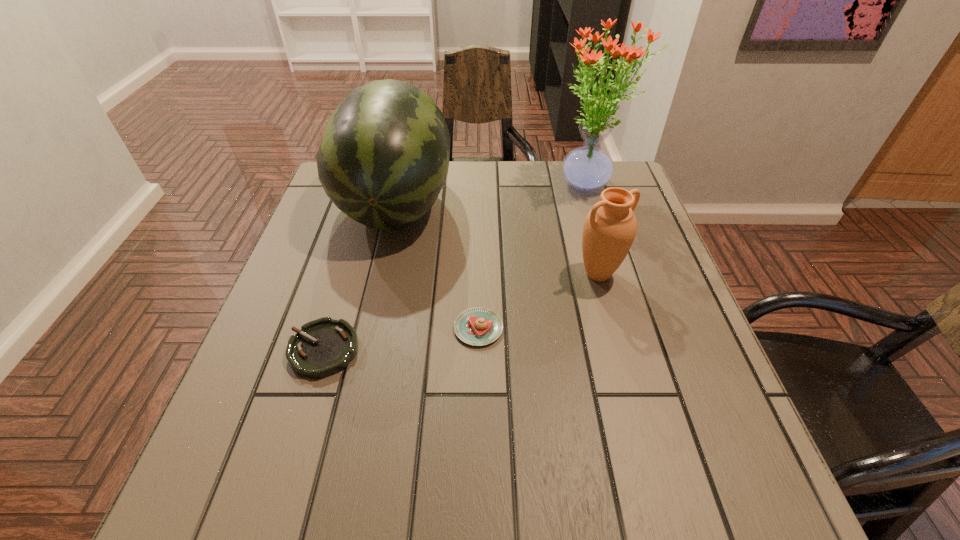
Locate an element on the screen. free space at the near edge of the desktop is located at coordinates (643, 501).

In the image, there is a desktop. Where is `free region at the left edge`? free region at the left edge is located at coordinates coord(292,394).

In the image, there is a desktop. Where is `vacant area at the right edge`? This screenshot has height=540, width=960. vacant area at the right edge is located at coordinates (674, 386).

This screenshot has width=960, height=540. In order to click on blank space at the far right corner of the desktop in this screenshot , I will do `click(614, 185)`.

I want to click on free space between the ashtray and the flower arrangement, so click(x=455, y=267).

Find the location of a particular element. The height and width of the screenshot is (540, 960). free area in between the shortest object and the tallest object is located at coordinates (455, 267).

The height and width of the screenshot is (540, 960). What are the coordinates of `free space between the third farthest object and the shortest object` in the screenshot? It's located at (461, 312).

Find the location of `vacant area between the watermelon and the ashtray`. vacant area between the watermelon and the ashtray is located at coordinates (360, 277).

Identify the location of free space between the third shortest object and the shortest object. (x=461, y=312).

The image size is (960, 540). In order to click on vacant region between the third farthest object and the second tallest object in this screenshot , I will do `click(496, 239)`.